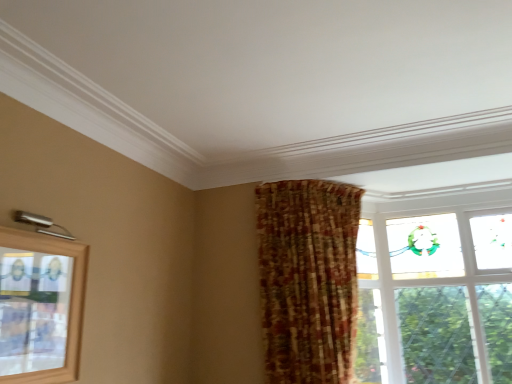
Question: Does clear glass window at upper right, which appears as the 2th window when viewed from the front, have a larger size compared to clear glass window at upper left, which appears as the 1th window when viewed from the front?

Choices:
 (A) no
 (B) yes

Answer: (B)

Question: Is clear glass window at upper right, which is the second window in left-to-right order, to the right of clear glass window at upper left, positioned as the 2th window in back-to-front order, from the viewer's perspective?

Choices:
 (A) yes
 (B) no

Answer: (A)

Question: Can you see clear glass window at upper right, which appears as the 2th window when viewed from the front, touching clear glass window at upper left, which appears as the 1th window when viewed from the front?

Choices:
 (A) yes
 (B) no

Answer: (B)

Question: Can you confirm if clear glass window at upper right, the 1th window positioned from the back, is taller than clear glass window at upper left, the 2th window viewed from the right?

Choices:
 (A) no
 (B) yes

Answer: (B)

Question: From the image's perspective, is clear glass window at upper right, the 1th window positioned from the back, above clear glass window at upper left, which appears as the 1th window when viewed from the front?

Choices:
 (A) yes
 (B) no

Answer: (B)

Question: Is clear glass window at upper left, positioned as the 2th window in back-to-front order, wider or thinner than plaid fabric curtain at center?

Choices:
 (A) thin
 (B) wide

Answer: (A)

Question: Is clear glass window at upper left, the 2th window viewed from the right, in front of or behind plaid fabric curtain at center in the image?

Choices:
 (A) front
 (B) behind

Answer: (A)

Question: From their relative heights in the image, would you say clear glass window at upper left, placed as the 1th window when sorted from left to right, is taller or shorter than plaid fabric curtain at center?

Choices:
 (A) short
 (B) tall

Answer: (A)

Question: Considering the positions of point (1, 228) and point (268, 226), is point (1, 228) closer or farther from the camera than point (268, 226)?

Choices:
 (A) closer
 (B) farther

Answer: (A)

Question: From the image's perspective, is clear glass window at upper right, which appears as the 2th window when viewed from the front, above or below plaid fabric curtain at center?

Choices:
 (A) below
 (B) above

Answer: (A)

Question: Is point (451, 332) positioned closer to the camera than point (282, 311)?

Choices:
 (A) farther
 (B) closer

Answer: (A)

Question: Which is correct: clear glass window at upper right, which is the second window in left-to-right order, is inside plaid fabric curtain at center, or outside of it?

Choices:
 (A) outside
 (B) inside

Answer: (A)

Question: Considering the relative positions of clear glass window at upper right, placed as the first window when sorted from right to left, and plaid fabric curtain at center in the image provided, is clear glass window at upper right, placed as the first window when sorted from right to left, to the left or to the right of plaid fabric curtain at center?

Choices:
 (A) left
 (B) right

Answer: (B)

Question: Is point (355, 211) positioned closer to the camera than point (445, 246)?

Choices:
 (A) closer
 (B) farther

Answer: (A)

Question: From a real-world perspective, is plaid fabric curtain at center positioned above or below clear glass window at upper right, which appears as the 2th window when viewed from the front?

Choices:
 (A) below
 (B) above

Answer: (B)